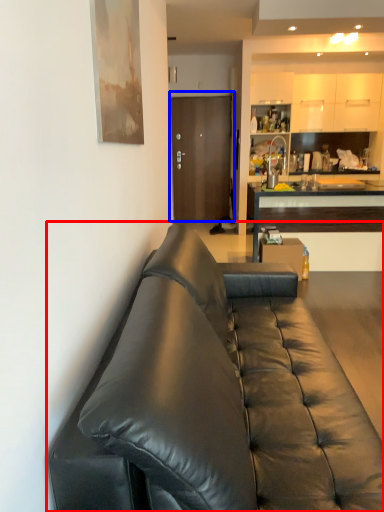
Question: Among these objects, which one is farthest to the camera, studio couch (highlighted by a red box) or door (highlighted by a blue box)?

Choices:
 (A) studio couch
 (B) door

Answer: (B)